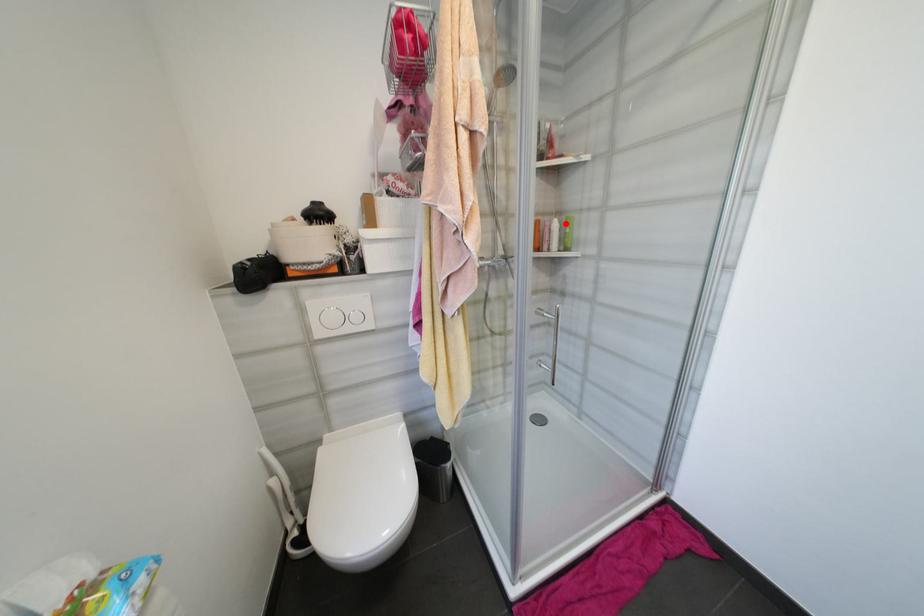
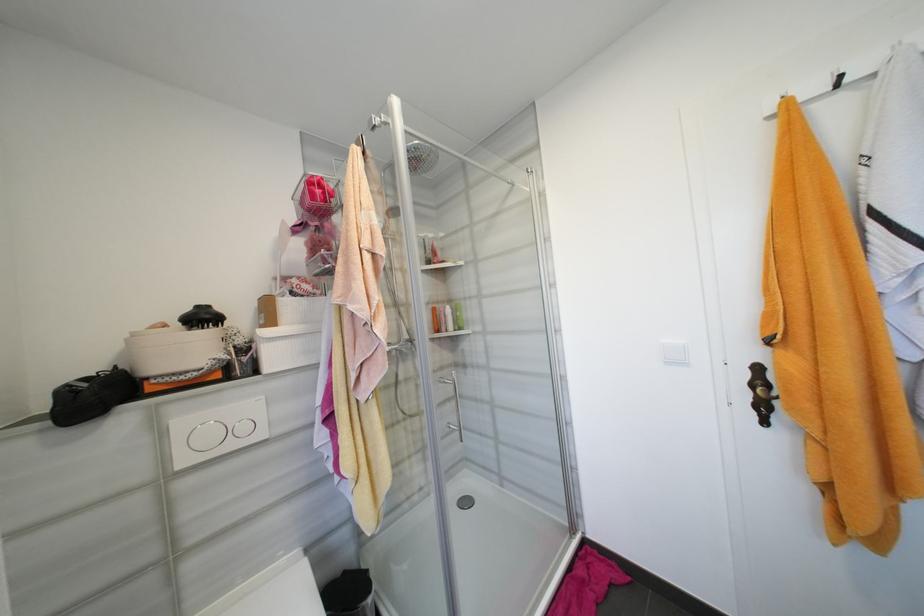
Where in the second image is the point corresponding to the highlighted location from the first image?

(457, 309)